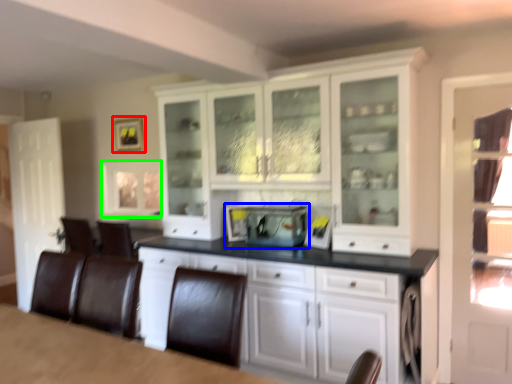
Question: Which object is positioned closest to picture frame (highlighted by a red box)? Select from appliance (highlighted by a blue box) and window (highlighted by a green box).

Choices:
 (A) appliance
 (B) window

Answer: (B)